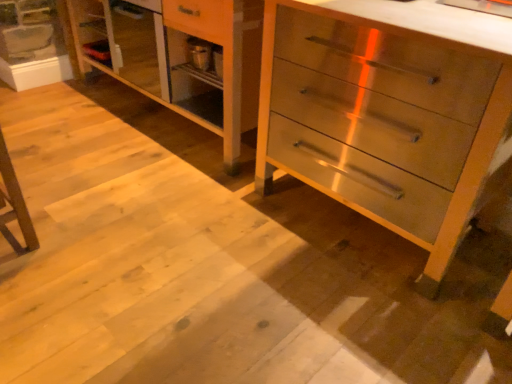
Question: Relative to metallic silver chest of drawers at center, is light wood dresser at center in front or behind?

Choices:
 (A) front
 (B) behind

Answer: (B)

Question: In the image, is light wood dresser at center on the left side or the right side of metallic silver chest of drawers at center?

Choices:
 (A) left
 (B) right

Answer: (A)

Question: From a real-world perspective, is light wood dresser at center above or below metallic silver chest of drawers at center?

Choices:
 (A) below
 (B) above

Answer: (A)

Question: Is metallic silver chest of drawers at center taller or shorter than light wood dresser at center?

Choices:
 (A) short
 (B) tall

Answer: (B)

Question: From the image's perspective, relative to light wood dresser at center, is metallic silver chest of drawers at center above or below?

Choices:
 (A) above
 (B) below

Answer: (B)

Question: In terms of size, does metallic silver chest of drawers at center appear bigger or smaller than light wood dresser at center?

Choices:
 (A) big
 (B) small

Answer: (B)

Question: Is metallic silver chest of drawers at center to the left or to the right of light wood dresser at center in the image?

Choices:
 (A) right
 (B) left

Answer: (A)